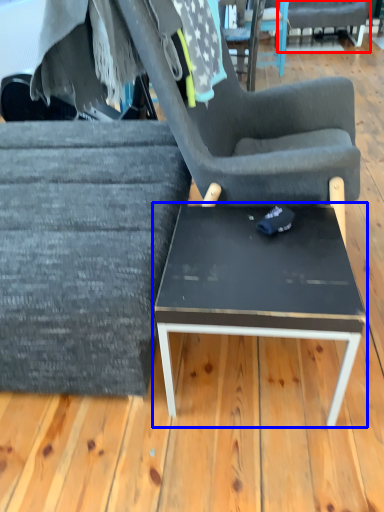
Question: Which point is further to the camera, chair (highlighted by a red box) or coffee table (highlighted by a blue box)?

Choices:
 (A) chair
 (B) coffee table

Answer: (A)